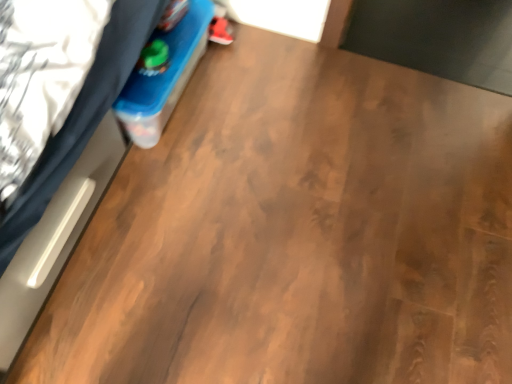
Question: Is matte red sneaker at upper center wider or thinner than white matte bed at left?

Choices:
 (A) thin
 (B) wide

Answer: (A)

Question: Is point (211, 39) closer or farther from the camera than point (95, 87)?

Choices:
 (A) closer
 (B) farther

Answer: (B)

Question: Considering the positions of matte red sneaker at upper center and white matte bed at left in the image, is matte red sneaker at upper center taller or shorter than white matte bed at left?

Choices:
 (A) short
 (B) tall

Answer: (A)

Question: Does point (14, 251) appear closer or farther from the camera than point (221, 29)?

Choices:
 (A) closer
 (B) farther

Answer: (A)

Question: Looking at their shapes, would you say white matte bed at left is wider or thinner than matte red sneaker at upper center?

Choices:
 (A) thin
 (B) wide

Answer: (B)

Question: In the image, is white matte bed at left on the left side or the right side of matte red sneaker at upper center?

Choices:
 (A) right
 (B) left

Answer: (B)

Question: Considering the positions of white matte bed at left and matte red sneaker at upper center in the image, is white matte bed at left taller or shorter than matte red sneaker at upper center?

Choices:
 (A) tall
 (B) short

Answer: (A)